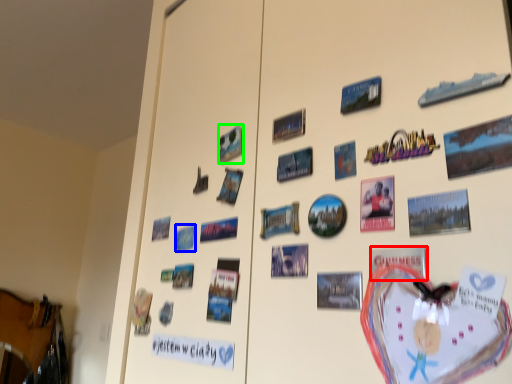
Question: Considering the real-world distances, which object is farthest from postcard (highlighted by a red box)? postcard (highlighted by a blue box) or postcard (highlighted by a green box)?

Choices:
 (A) postcard
 (B) postcard

Answer: (A)